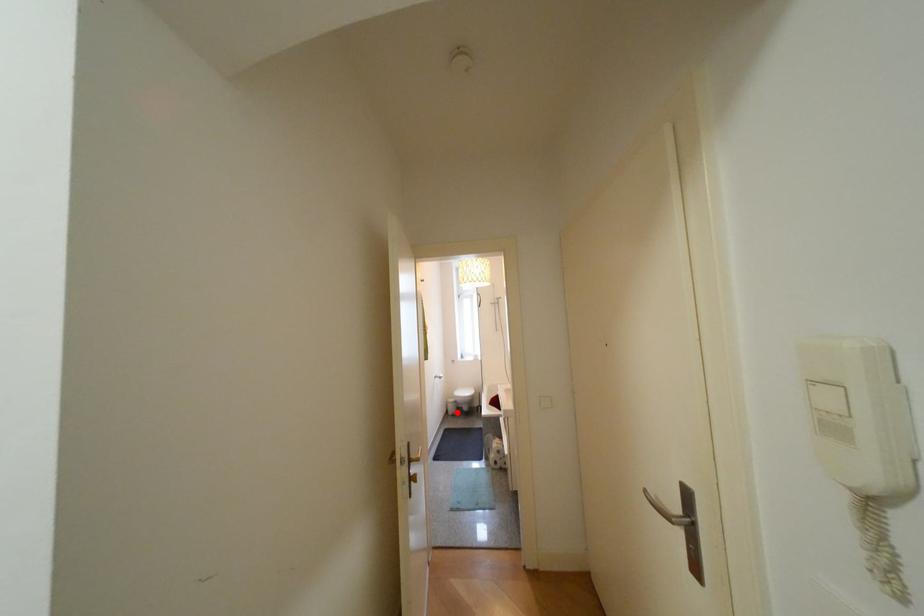
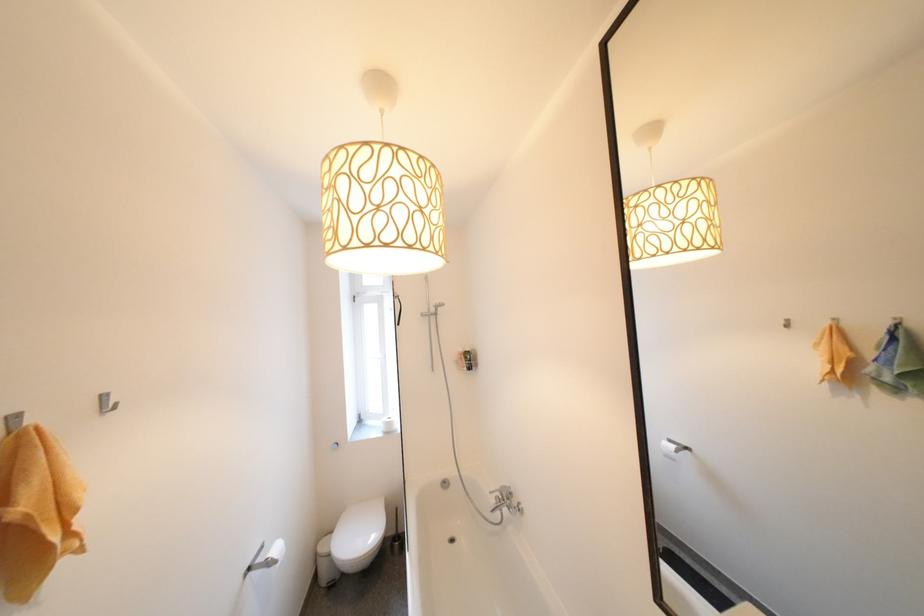
In the second image, find the point that corresponds to the highlighted location in the first image.

(325, 578)